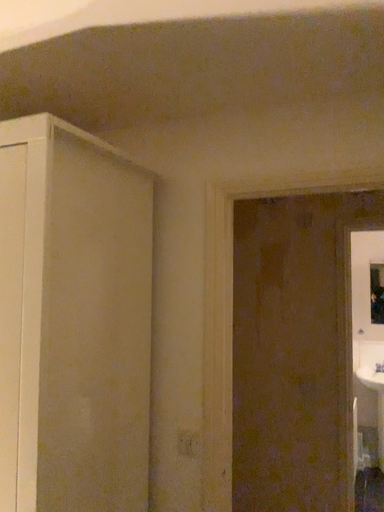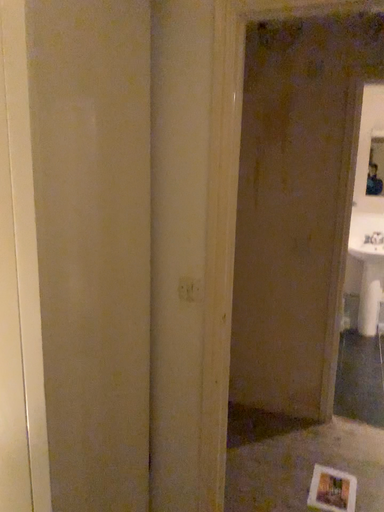
Question: Which way did the camera rotate in the video?

Choices:
 (A) rotated upward
 (B) rotated downward

Answer: (B)